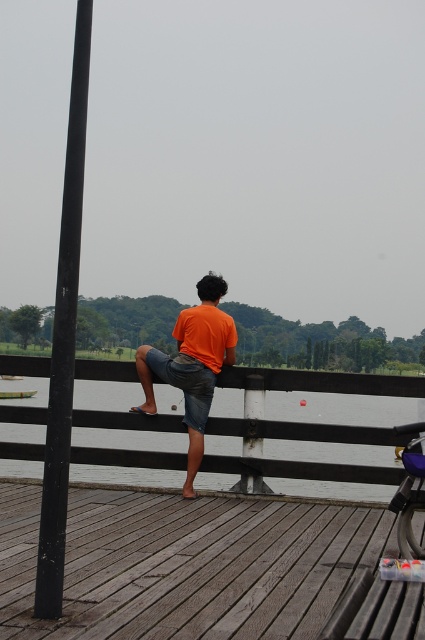
Who is higher up, black matte pole at left or orange cotton shirt at center?

Positioned higher is black matte pole at left.

Between point (79, 209) and point (209, 376), which one is positioned in front?

Point (79, 209)

Locate an element on the screen. black matte pole at left is located at coordinates (64, 337).

Is wooden dock at center further to the viewer compared to black matte pole at left?

That is False.

Does wooden dock at center come in front of black matte pole at left?

Yes, wooden dock at center is closer to the viewer.

Who is more forward, (x=0, y=600) or (x=48, y=442)?

Point (x=48, y=442) is in front.

Identify the location of wooden dock at center. (206, 568).

Does wooden at center have a greater height compared to black matte pole at left?

In fact, wooden at center may be shorter than black matte pole at left.

Is wooden at center positioned before black matte pole at left?

No.

Who is more forward, (x=368, y=464) or (x=50, y=456)?

Point (x=50, y=456) is more forward.

This screenshot has height=640, width=425. Identify the location of wooden at center. (308, 449).